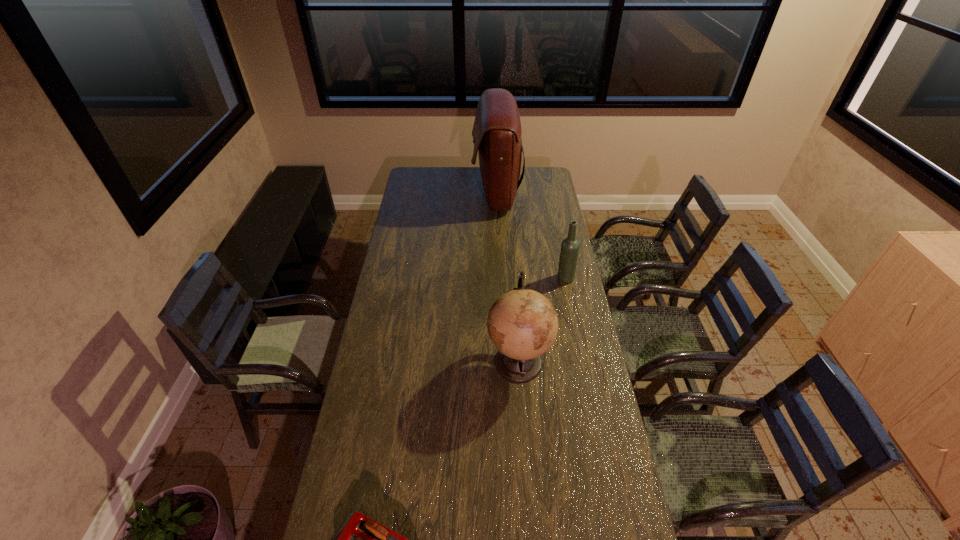
You are a GUI agent. You are given a task and a screenshot of the screen. Output one action in this format:
    pyautogui.click(x=<x>, y=<y>)
    Task: Click on the free space located 0.360m on the front-facing side of the globe
    
    Given the screenshot: What is the action you would take?
    pyautogui.click(x=394, y=361)

Identify the location of vacant space located on the front of the third nearest object. The height and width of the screenshot is (540, 960). pyautogui.click(x=577, y=335).

Image resolution: width=960 pixels, height=540 pixels. I want to click on object located at the far edge, so click(497, 132).

This screenshot has height=540, width=960. What are the coordinates of `object present at the right edge` in the screenshot? It's located at (570, 246).

I want to click on vacant space at the far edge of the desktop, so click(465, 171).

Locate an element on the screen. free space at the left edge of the desktop is located at coordinates (392, 332).

Identify the location of vacant region at the right edge. The height and width of the screenshot is (540, 960). (537, 250).

The height and width of the screenshot is (540, 960). Identify the location of free space at the far left corner of the desktop. (422, 179).

Locate an element on the screen. The height and width of the screenshot is (540, 960). vacant space at the far right corner of the desktop is located at coordinates (533, 173).

Find the location of a particular element. This screenshot has width=960, height=540. free spot between the globe and the tallest object is located at coordinates (507, 277).